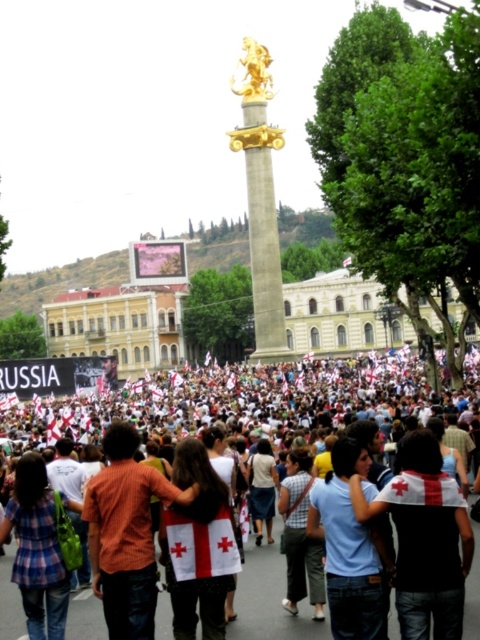
The image size is (480, 640). In order to click on white fabric crowd at center in this screenshot , I will do (245, 403).

Measure the distance between white fabric crowd at center and camera.

white fabric crowd at center and camera are 127.24 feet apart.

Between point (269, 428) and point (242, 67), which one is positioned behind?

The point (242, 67) is behind.

You are a GUI agent. You are given a task and a screenshot of the screen. Output one action in this format:
    pyautogui.click(x=<x>, y=<y>)
    Task: Click on the white fabric crowd at center
    
    Given the screenshot: What is the action you would take?
    pyautogui.click(x=245, y=403)

Which of these two, orange shirt at center or gold polished metal column at center, stands taller?

Standing taller between the two is gold polished metal column at center.

Is point (146, 483) positioned behind point (280, 301)?

That is False.

Identify the location of orange shirt at center. (126, 532).

Is white fabric crowd at center below gold polished metal column at center?

Correct, white fabric crowd at center is located below gold polished metal column at center.

Can you confirm if white fabric crowd at center is thinner than gold polished metal column at center?

In fact, white fabric crowd at center might be wider than gold polished metal column at center.

Is point (312, 442) closer to camera compared to point (250, 88)?

Yes, point (312, 442) is closer to viewer.

The image size is (480, 640). I want to click on white fabric crowd at center, so click(245, 403).